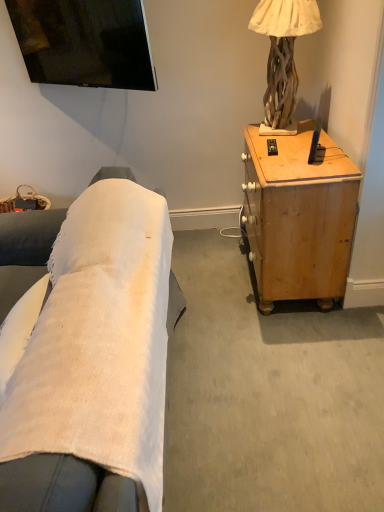
Question: From the image's perspective, is black plastic remote control at upper right below natural wood lamp at upper right?

Choices:
 (A) no
 (B) yes

Answer: (B)

Question: From a real-world perspective, does black plastic remote control at upper right stand above natural wood lamp at upper right?

Choices:
 (A) no
 (B) yes

Answer: (A)

Question: Can you confirm if black plastic remote control at upper right is taller than natural wood lamp at upper right?

Choices:
 (A) yes
 (B) no

Answer: (B)

Question: From a real-world perspective, is black plastic remote control at upper right positioned under natural wood lamp at upper right based on gravity?

Choices:
 (A) no
 (B) yes

Answer: (B)

Question: Considering the relative sizes of black plastic remote control at upper right and natural wood lamp at upper right in the image provided, is black plastic remote control at upper right shorter than natural wood lamp at upper right?

Choices:
 (A) yes
 (B) no

Answer: (A)

Question: From the image's perspective, is light brown wood desk at right positioned above or below natural wood lamp at upper right?

Choices:
 (A) below
 (B) above

Answer: (A)

Question: Is light brown wood desk at right bigger or smaller than natural wood lamp at upper right?

Choices:
 (A) big
 (B) small

Answer: (A)

Question: Is light brown wood desk at right wider or thinner than natural wood lamp at upper right?

Choices:
 (A) wide
 (B) thin

Answer: (A)

Question: Considering the positions of light brown wood desk at right and natural wood lamp at upper right in the image, is light brown wood desk at right taller or shorter than natural wood lamp at upper right?

Choices:
 (A) short
 (B) tall

Answer: (B)

Question: Is black plastic remote control at upper right bigger or smaller than natural wood lamp at upper right?

Choices:
 (A) big
 (B) small

Answer: (B)

Question: Is black plastic remote control at upper right spatially inside natural wood lamp at upper right, or outside of it?

Choices:
 (A) outside
 (B) inside

Answer: (A)

Question: From their relative heights in the image, would you say black plastic remote control at upper right is taller or shorter than natural wood lamp at upper right?

Choices:
 (A) tall
 (B) short

Answer: (B)

Question: From the image's perspective, is black plastic remote control at upper right located above or below natural wood lamp at upper right?

Choices:
 (A) below
 (B) above

Answer: (A)

Question: From the image's perspective, relative to light brown wood desk at right, is black plastic remote control at upper right above or below?

Choices:
 (A) above
 (B) below

Answer: (A)

Question: From their relative heights in the image, would you say black plastic remote control at upper right is taller or shorter than light brown wood desk at right?

Choices:
 (A) short
 (B) tall

Answer: (A)